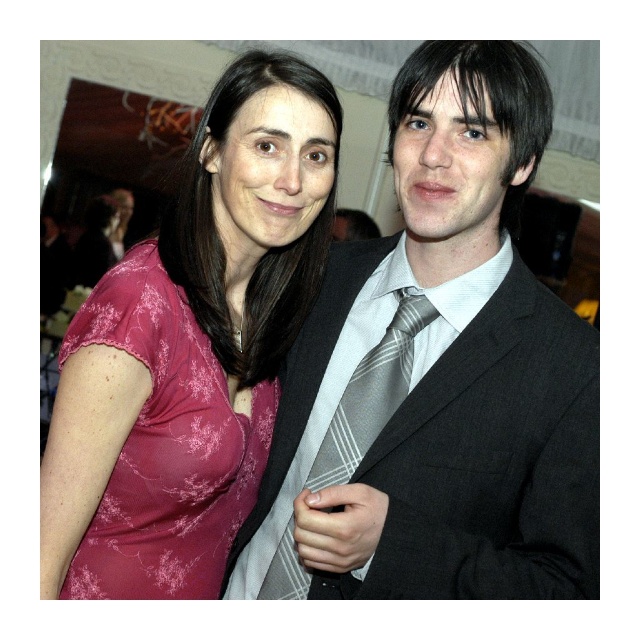
Can you confirm if gray striped tie at center is positioned to the left of pink floral dress at center?

No, gray striped tie at center is not to the left of pink floral dress at center.

Image resolution: width=640 pixels, height=640 pixels. Identify the location of gray striped tie at center. (436, 376).

The height and width of the screenshot is (640, 640). I want to click on gray striped tie at center, so click(x=436, y=376).

Can you confirm if pink floral dress at center is bigger than silver striped tie at center?

Yes.

Does pink floral dress at center have a lesser height compared to silver striped tie at center?

In fact, pink floral dress at center may be taller than silver striped tie at center.

Does point (237, 225) lie behind point (323, 474)?

Yes, point (237, 225) is behind point (323, 474).

Find the location of `pink floral dress at center`. pink floral dress at center is located at coordinates (189, 348).

Does gray striped tie at center have a greater width compared to pink floral fabric dress at left?

Yes.

Between gray striped tie at center and pink floral fabric dress at left, which one has less height?

Standing shorter between the two is pink floral fabric dress at left.

Between point (481, 214) and point (108, 584), which one is positioned in front?

Point (481, 214)

You are a GUI agent. You are given a task and a screenshot of the screen. Output one action in this format:
    pyautogui.click(x=<x>, y=<y>)
    Task: Click on the gray striped tie at center
    The width and height of the screenshot is (640, 640).
    Given the screenshot: What is the action you would take?
    pyautogui.click(x=436, y=376)